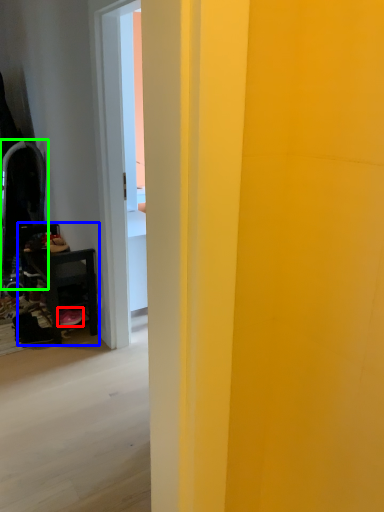
Question: Estimate the real-world distances between objects in this image. Which object is farther from footwear (highlighted by a red box), furniture (highlighted by a blue box) or swivel chair (highlighted by a green box)?

Choices:
 (A) furniture
 (B) swivel chair

Answer: (B)